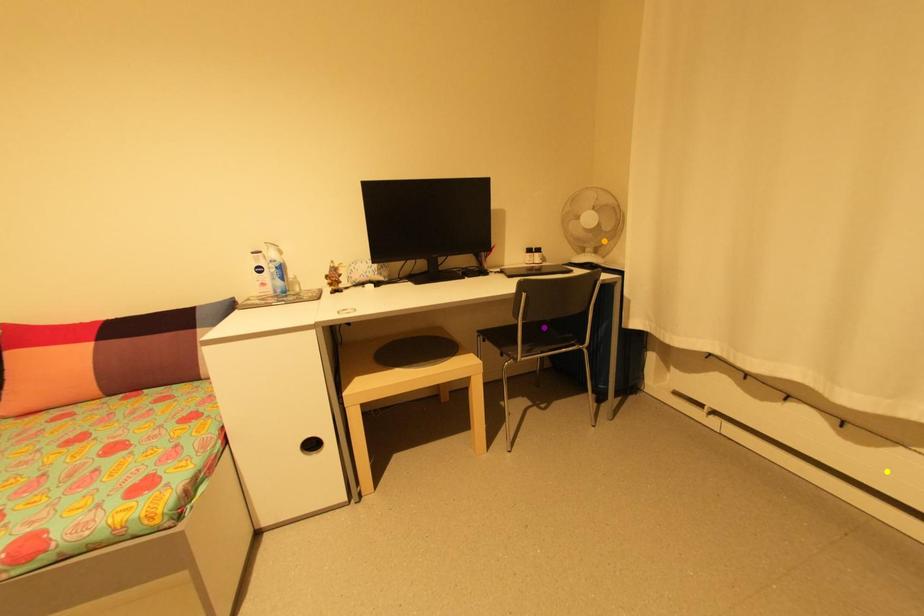
Order these from nearest to farthest:
purple point, yellow point, orange point

1. yellow point
2. purple point
3. orange point